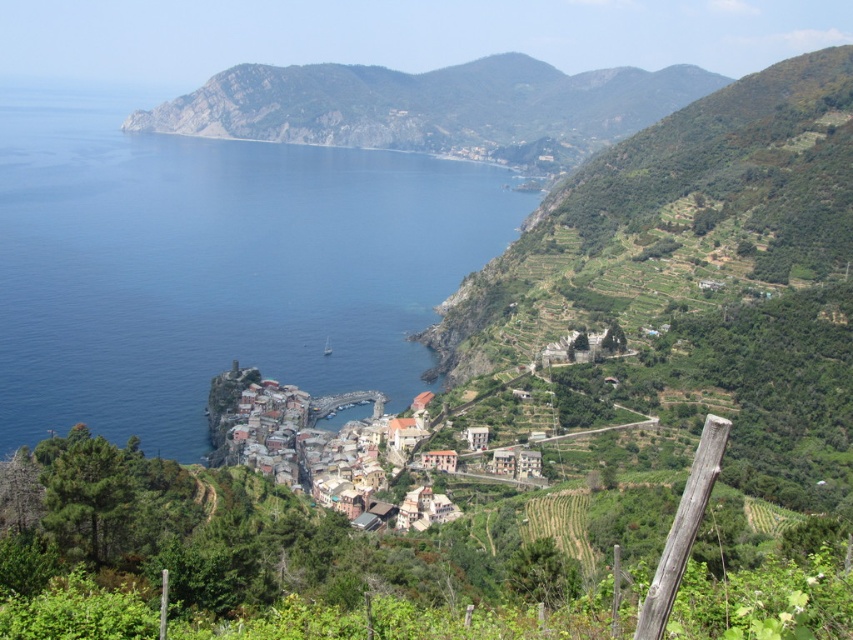
You are standing at the viewpoint marked by the wooden post in the bottom right corner of the image. You see two points in the scene, point A at coordinates point A is point [173,129] and point B at coordinates point B is point [216,422]. Which point is closer to you?

Point A at coordinates point A is point [173,129] is closer to you because it is further to the viewer than point B at coordinates point B is point [216,422].

You are standing at the wooden post in the bottom right corner of the image and want to take a photo of both the green rocky mountain at upper center and the terracotta clay houses at center. Which direction should you turn to ensure both are in your frame?

You should turn to the left so that the green rocky mountain at upper center, which is positioned to the left of the terracotta clay houses at center, comes into view while keeping both in your frame.

You are a tourist standing at the viewpoint marked by the wooden post in the bottom right corner of the image. You see the blue water at center and the green rocky mountain at upper center. Which of these two features occupies a larger area in the scene?

The blue water at center occupies a larger area than the green rocky mountain at upper center according to the description.